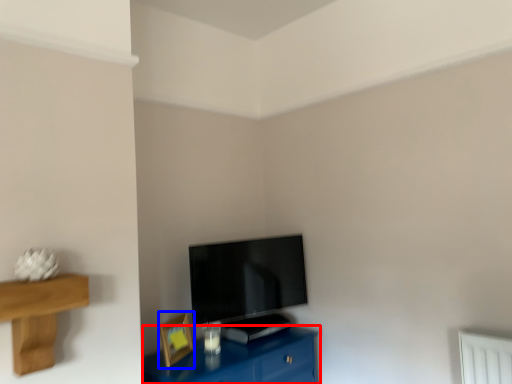
Question: Among these objects, which one is farthest to the camera, table (highlighted by a red box) or picture frame (highlighted by a blue box)?

Choices:
 (A) table
 (B) picture frame

Answer: (B)